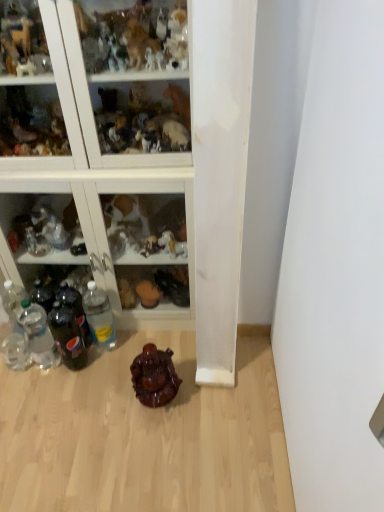
The height and width of the screenshot is (512, 384). In order to click on free location to the right of clear plastic bottles at left, the fifth bottle positioned from the right in this screenshot , I will do `click(64, 376)`.